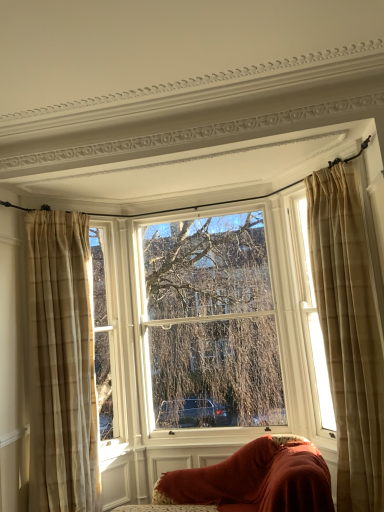
This screenshot has height=512, width=384. Describe the element at coordinates (207, 331) in the screenshot. I see `clear glass window at center, marked as the 1th window in a left-to-right arrangement` at that location.

Identify the location of beige plaid curtain at right, which ranks as the second curtain in left-to-right order. The image size is (384, 512). (348, 333).

This screenshot has height=512, width=384. What do you see at coordinates (310, 313) in the screenshot?
I see `sheer beige curtains at right, which is the 2th window from left to right` at bounding box center [310, 313].

Identify the location of velvet red sofa at lower center. tap(250, 481).

In the scene shown: Would you say beige plaid curtain at right, which is counted as the first curtain, starting from the right, is part of velvet red sofa at lower center's contents?

That's incorrect, beige plaid curtain at right, which is counted as the first curtain, starting from the right, is not inside velvet red sofa at lower center.

Is point (254, 496) closer or farther from the camera than point (358, 233)?

Point (254, 496) is positioned farther from the camera compared to point (358, 233).

From a real-world perspective, which is physically below, velvet red sofa at lower center or beige plaid curtain at right, which ranks as the second curtain in left-to-right order?

velvet red sofa at lower center, from a real-world perspective.

You are a GUI agent. You are given a task and a screenshot of the screen. Output one action in this format:
    pyautogui.click(x=<x>, y=<y>)
    Task: Click on the furniture below the beige plaid curtain at right, which is counted as the first curtain, starting from the right (from the image's perspective)
    This screenshot has width=384, height=512.
    Given the screenshot: What is the action you would take?
    pyautogui.click(x=250, y=481)

Identify the location of furniture that appears in front of the beige plaid curtain at left, arranged as the 1th curtain when viewed from the left. (250, 481).

From the image's perspective, which is below, velvet red sofa at lower center or beige plaid curtain at left, arranged as the 1th curtain when viewed from the left?

From the image's view, velvet red sofa at lower center is below.

Between point (228, 504) and point (90, 409), which one is positioned behind?

Positioned behind is point (90, 409).

Are beige plaid curtain at left, arranged as the 1th curtain when viewed from the left, and sheer beige curtains at right, which appears as the 1th window when viewed from the right, located far from each other?

Indeed, beige plaid curtain at left, arranged as the 1th curtain when viewed from the left, is not near sheer beige curtains at right, which appears as the 1th window when viewed from the right.

Could you tell me if beige plaid curtain at left, which ranks as the second curtain in right-to-left order, is turned towards sheer beige curtains at right, which appears as the 1th window when viewed from the right?

No, beige plaid curtain at left, which ranks as the second curtain in right-to-left order, does not turn towards sheer beige curtains at right, which appears as the 1th window when viewed from the right.

Which point is more distant from viewer, (x=89, y=328) or (x=327, y=420)?

The point (x=327, y=420) is farther.

Is beige plaid curtain at left, arranged as the 1th curtain when viewed from the left, surrounding sheer beige curtains at right, which is the 2th window from left to right?

No, sheer beige curtains at right, which is the 2th window from left to right, is not surrounded by beige plaid curtain at left, arranged as the 1th curtain when viewed from the left.

What's the angular difference between velvet red sofa at lower center and clear glass window at center, marked as the 1th window in a left-to-right arrangement,'s facing directions?

There is a 0.76-degree angle between the facing directions of velvet red sofa at lower center and clear glass window at center, marked as the 1th window in a left-to-right arrangement.

Considering the relative sizes of velvet red sofa at lower center and clear glass window at center, marked as the 1th window in a left-to-right arrangement, in the image provided, is velvet red sofa at lower center shorter than clear glass window at center, marked as the 1th window in a left-to-right arrangement,?

Yes.

Is velvet red sofa at lower center oriented towards clear glass window at center, placed as the 2th window when sorted from right to left?

No, velvet red sofa at lower center is not turned towards clear glass window at center, placed as the 2th window when sorted from right to left.

Does point (242, 483) lie in front of point (124, 349)?

Yes, point (242, 483) is in front of point (124, 349).

Between point (252, 409) and point (232, 457), which one is positioned in front?

Point (232, 457)

You are a GUI agent. You are given a task and a screenshot of the screen. Output one action in this format:
    pyautogui.click(x=<x>, y=<y>)
    Task: Click on the window that is the 2nd object located behind the velvet red sofa at lower center
    
    Given the screenshot: What is the action you would take?
    pyautogui.click(x=207, y=331)

Which is correct: clear glass window at center, placed as the 2th window when sorted from right to left, is inside velvet red sofa at lower center, or outside of it?

clear glass window at center, placed as the 2th window when sorted from right to left, exists outside the volume of velvet red sofa at lower center.

Does clear glass window at center, placed as the 2th window when sorted from right to left, lie in front of velvet red sofa at lower center?

No, clear glass window at center, placed as the 2th window when sorted from right to left, is further to the viewer.

Considering the relative sizes of beige plaid curtain at right, which ranks as the second curtain in left-to-right order, and velvet red sofa at lower center in the image provided, is beige plaid curtain at right, which ranks as the second curtain in left-to-right order, shorter than velvet red sofa at lower center?

In fact, beige plaid curtain at right, which ranks as the second curtain in left-to-right order, may be taller than velvet red sofa at lower center.

Is beige plaid curtain at right, which is counted as the first curtain, starting from the right, closer to the viewer compared to velvet red sofa at lower center?

Yes, beige plaid curtain at right, which is counted as the first curtain, starting from the right, is closer to the viewer.

Does point (332, 371) come farther from viewer compared to point (287, 470)?

Yes.

Is point (319, 374) positioned after point (151, 389)?

No, (319, 374) is closer to viewer.

Is sheer beige curtains at right, which is the 2th window from left to right, positioned before clear glass window at center, marked as the 1th window in a left-to-right arrangement?

Yes, sheer beige curtains at right, which is the 2th window from left to right, is closer to the camera.

From the picture: Could you tell me if sheer beige curtains at right, which appears as the 1th window when viewed from the right, is facing clear glass window at center, placed as the 2th window when sorted from right to left?

No, sheer beige curtains at right, which appears as the 1th window when viewed from the right, does not turn towards clear glass window at center, placed as the 2th window when sorted from right to left.

Where is `furniture directly beneath the beige plaid curtain at right, which ranks as the second curtain in left-to-right order (from a real-world perspective)`? This screenshot has width=384, height=512. furniture directly beneath the beige plaid curtain at right, which ranks as the second curtain in left-to-right order (from a real-world perspective) is located at coordinates (250, 481).

Locate an element on the screen. the 1st curtain above the velvet red sofa at lower center (from a real-world perspective) is located at coordinates (62, 364).

Estimate the real-world distances between objects in this image. Which object is further from velvet red sofa at lower center, clear glass window at center, marked as the 1th window in a left-to-right arrangement, or sheer beige curtains at right, which is the 2th window from left to right?

sheer beige curtains at right, which is the 2th window from left to right, is further to velvet red sofa at lower center.

When comparing their distances from beige plaid curtain at left, which ranks as the second curtain in right-to-left order, does clear glass window at center, placed as the 2th window when sorted from right to left, or velvet red sofa at lower center seem closer?

Among the two, clear glass window at center, placed as the 2th window when sorted from right to left, is located nearer to beige plaid curtain at left, which ranks as the second curtain in right-to-left order.

Considering their positions, is velvet red sofa at lower center positioned further to sheer beige curtains at right, which is the 2th window from left to right, than beige plaid curtain at left, which ranks as the second curtain in right-to-left order?

The object further to sheer beige curtains at right, which is the 2th window from left to right, is beige plaid curtain at left, which ranks as the second curtain in right-to-left order.

Considering their positions, is clear glass window at center, marked as the 1th window in a left-to-right arrangement, positioned closer to velvet red sofa at lower center than beige plaid curtain at right, which ranks as the second curtain in left-to-right order?

The object closer to velvet red sofa at lower center is beige plaid curtain at right, which ranks as the second curtain in left-to-right order.

Looking at the image, which one is located closer to velvet red sofa at lower center, beige plaid curtain at left, which ranks as the second curtain in right-to-left order, or sheer beige curtains at right, which is the 2th window from left to right?

Among the two, sheer beige curtains at right, which is the 2th window from left to right, is located nearer to velvet red sofa at lower center.

Consider the image. From the image, which object appears to be nearer to beige plaid curtain at right, which ranks as the second curtain in left-to-right order, sheer beige curtains at right, which appears as the 1th window when viewed from the right, or velvet red sofa at lower center?

sheer beige curtains at right, which appears as the 1th window when viewed from the right, is positioned closer to the anchor beige plaid curtain at right, which ranks as the second curtain in left-to-right order.

Looking at this image, when comparing their distances from sheer beige curtains at right, which appears as the 1th window when viewed from the right, does beige plaid curtain at right, which is counted as the first curtain, starting from the right, or beige plaid curtain at left, arranged as the 1th curtain when viewed from the left, seem further?

beige plaid curtain at left, arranged as the 1th curtain when viewed from the left.

Which object lies further to the anchor point beige plaid curtain at left, arranged as the 1th curtain when viewed from the left, velvet red sofa at lower center or sheer beige curtains at right, which is the 2th window from left to right?

sheer beige curtains at right, which is the 2th window from left to right.

Locate an element on the screen. window between beige plaid curtain at left, which ranks as the second curtain in right-to-left order, and velvet red sofa at lower center, in the horizontal direction is located at coordinates (207, 331).

Find the location of `window between sheer beige curtains at right, which appears as the 1th window when viewed from the right, and velvet red sofa at lower center vertically`. window between sheer beige curtains at right, which appears as the 1th window when viewed from the right, and velvet red sofa at lower center vertically is located at coordinates (207, 331).

Find the location of a particular element. This screenshot has height=512, width=384. furniture positioned between beige plaid curtain at right, which is counted as the first curtain, starting from the right, and clear glass window at center, placed as the 2th window when sorted from right to left, from near to far is located at coordinates (250, 481).

Locate an element on the screen. This screenshot has width=384, height=512. window between beige plaid curtain at left, arranged as the 1th curtain when viewed from the left, and sheer beige curtains at right, which is the 2th window from left to right is located at coordinates pos(207,331).